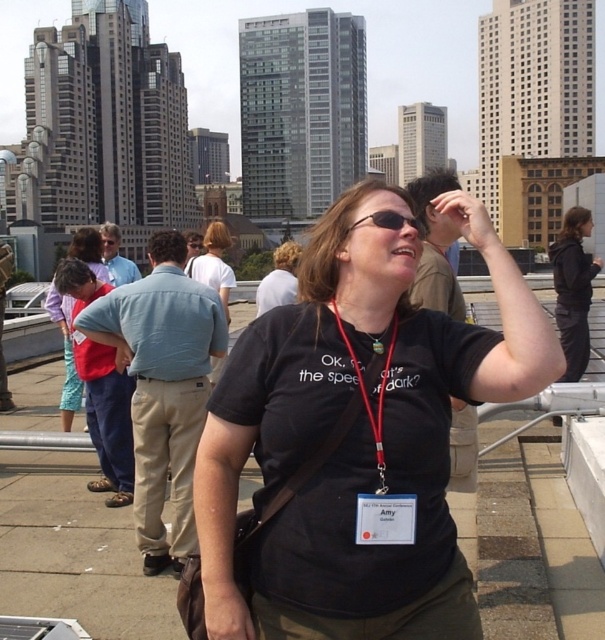
From the picture: Is black matte t-shirt at center in front of dark gray hoodie at upper right?

Yes, it is in front of dark gray hoodie at upper right.

Which of these two, black matte t-shirt at center or dark gray hoodie at upper right, stands shorter?

With less height is black matte t-shirt at center.

Where is `black matte t-shirt at center`? The image size is (605, 640). black matte t-shirt at center is located at coordinates (358, 433).

Who is lower down, matte red shirt at left or matte white shirt at center?

matte red shirt at left is lower down.

Which is more to the right, matte red shirt at left or matte white shirt at center?

matte white shirt at center

Find the location of a particular element. This screenshot has width=605, height=640. matte red shirt at left is located at coordinates (64, 355).

At what (x,y) coordinates should I click in order to perform the action: click on matte red shirt at left. Please return your answer as a coordinate pair (x, y). The height and width of the screenshot is (640, 605). Looking at the image, I should click on (64, 355).

Measure the distance between point [59,321] and camera.

Point [59,321] and camera are 32.21 meters apart.

Can you confirm if matte red shirt at left is positioned to the right of sunglasses at center?

No, matte red shirt at left is not to the right of sunglasses at center.

Who is more forward, (74, 372) or (355, 227)?

Point (355, 227) is in front.

This screenshot has height=640, width=605. In order to click on matte red shirt at left in this screenshot , I will do `click(64, 355)`.